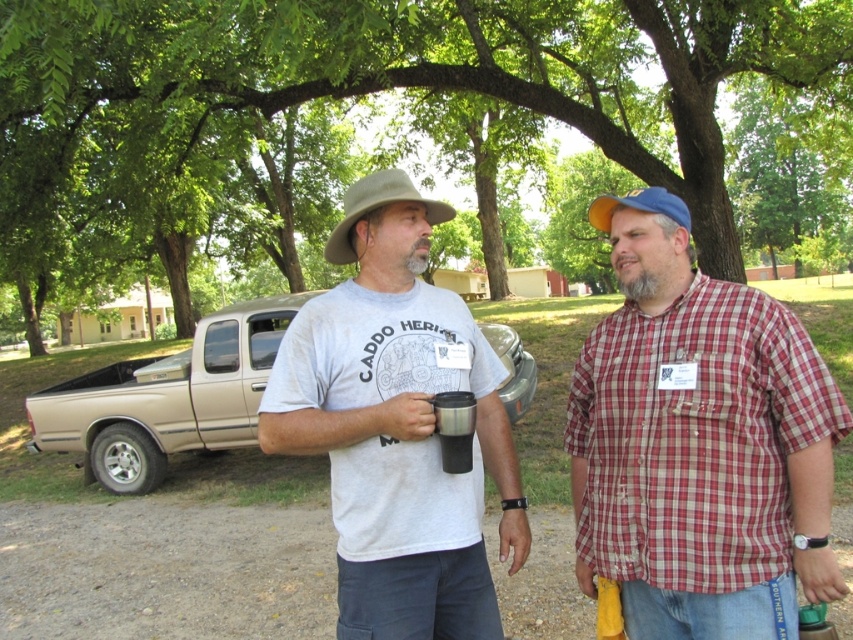
Question: Is green leafy tree at upper center above green felt cowboy hat at center?

Choices:
 (A) yes
 (B) no

Answer: (A)

Question: Which point is closer to the camera?

Choices:
 (A) silver metallic pickup truck at center
 (B) plaid cotton shirt at center

Answer: (B)

Question: Which point is closer to the camera?

Choices:
 (A) silver metallic pickup truck at center
 (B) plaid cotton shirt at center
 (C) green leafy tree at upper center

Answer: (B)

Question: Which is nearer to the green felt cowboy hat at center?

Choices:
 (A) green leafy tree at upper center
 (B) matte gray t-shirt at center
 (C) plaid cotton shirt at center
 (D) white matte t-shirt at center

Answer: (B)

Question: Can you confirm if plaid cotton shirt at center is thinner than matte gray t-shirt at center?

Choices:
 (A) yes
 (B) no

Answer: (B)

Question: Observing the image, what is the correct spatial positioning of plaid cotton shirt at center in reference to matte gray t-shirt at center?

Choices:
 (A) right
 (B) left

Answer: (A)